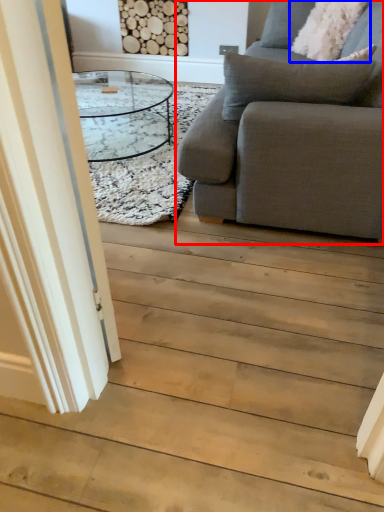
Question: Among these objects, which one is nearest to the camera, studio couch (highlighted by a red box) or pillow (highlighted by a blue box)?

Choices:
 (A) studio couch
 (B) pillow

Answer: (A)